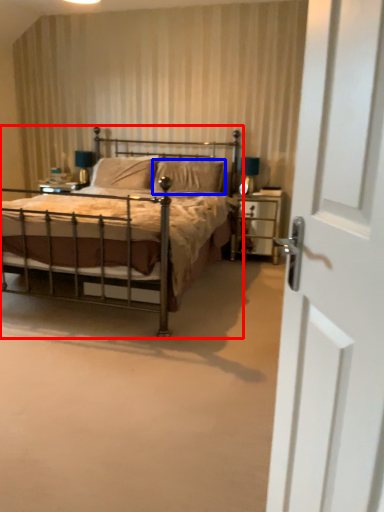
Question: Which object appears farthest to the camera in this image, bed (highlighted by a red box) or pillow (highlighted by a blue box)?

Choices:
 (A) bed
 (B) pillow

Answer: (B)